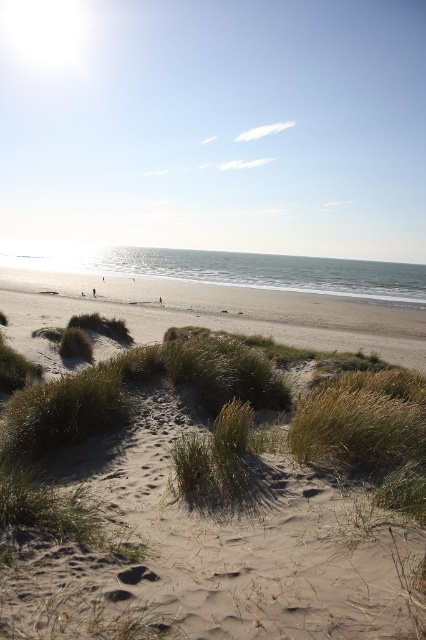
In the scene shown: Can you confirm if sandy beige dunes at center is wider than brown sand at lower center?

No.

Looking at this image, does sandy beige dunes at center appear on the left side of brown sand at lower center?

No, sandy beige dunes at center is not to the left of brown sand at lower center.

This screenshot has height=640, width=426. Identify the location of sandy beige dunes at center. (249, 545).